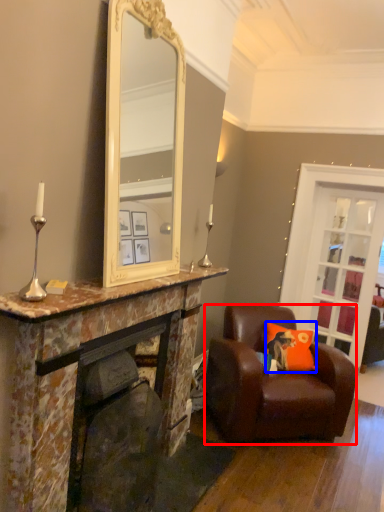
Question: Which of the following is the farthest to the observer, chair (highlighted by a red box) or cushion (highlighted by a blue box)?

Choices:
 (A) chair
 (B) cushion

Answer: (B)